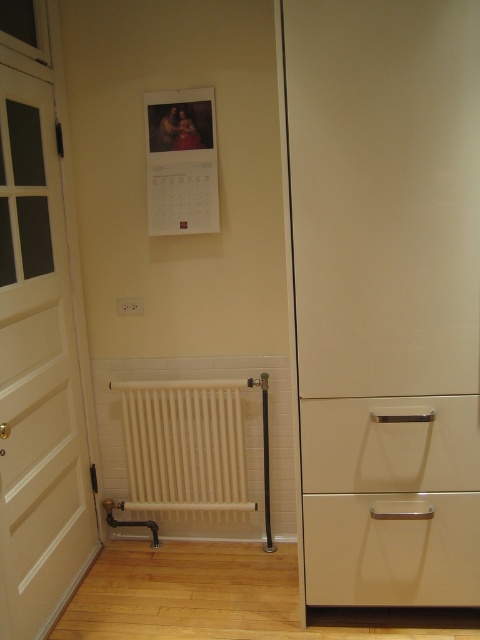
You are moving a large painting that is 1.2 meters wide. You want to hang it on the wall between the white matte door at left and the white matte drawer at center right. Considering the space between them, will the painting fit?

The white matte door at left is larger than the white matte drawer at center right. However, without specific measurements of the gap between them, it is impossible to determine if the 1.2 meter wide painting will fit. Please measure the available space before deciding.